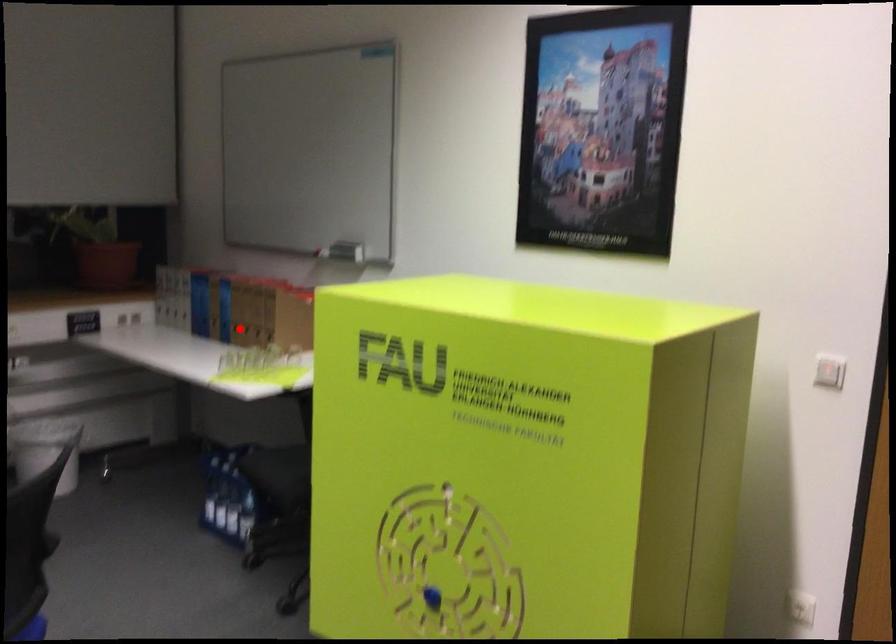
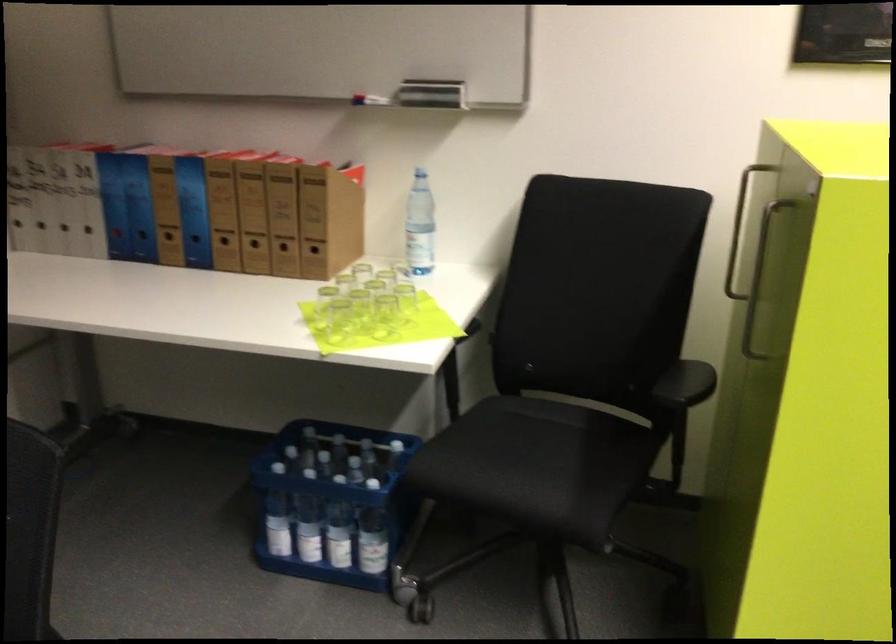
Question: I am providing you with two images of the same scene from different viewpoints. In image1, a red point is highlighted. Considering the same 3D point in image2, which of the following is correct?

Choices:
 (A) It is closer
 (B) It is farther

Answer: (A)